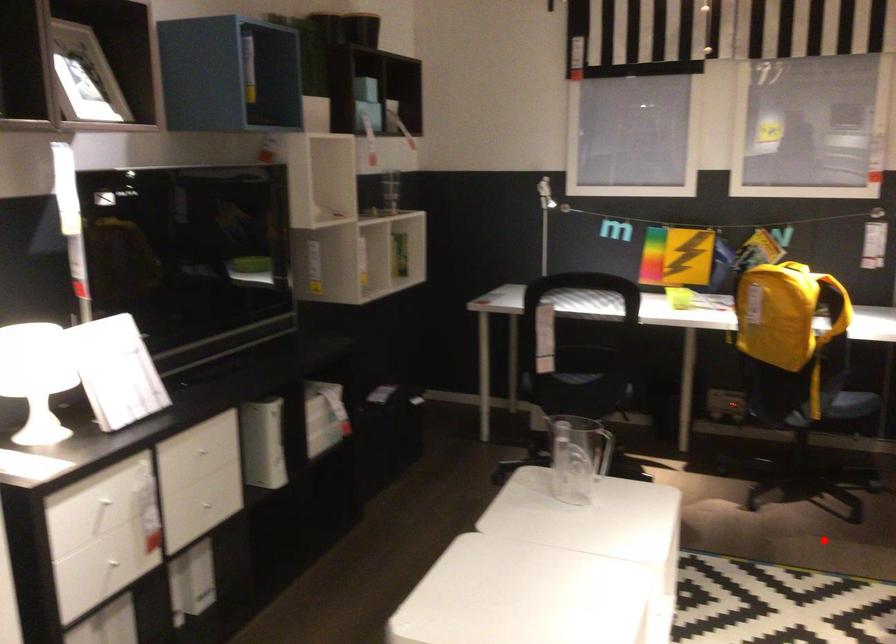
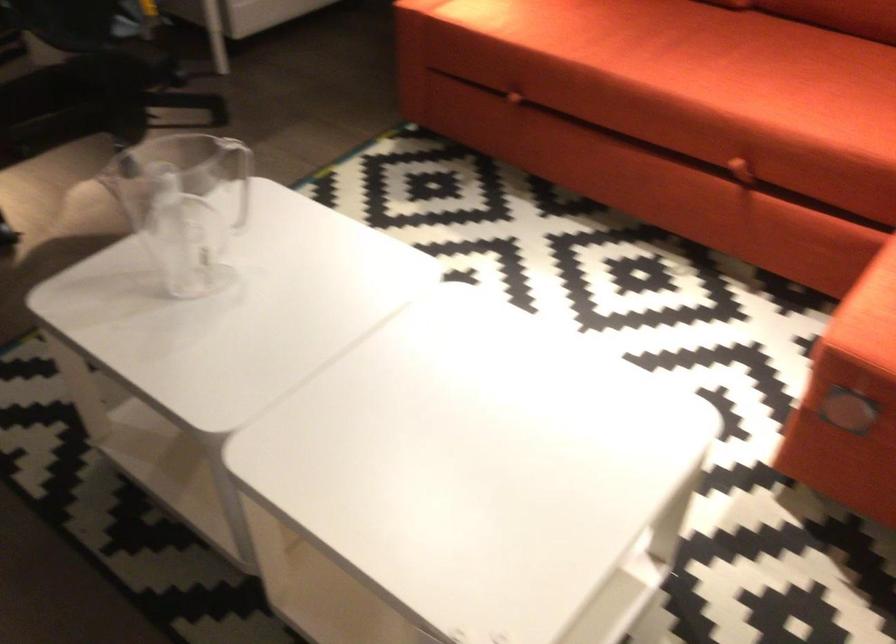
In the second image, find the point that corresponds to the highlighted location in the first image.

(238, 176)